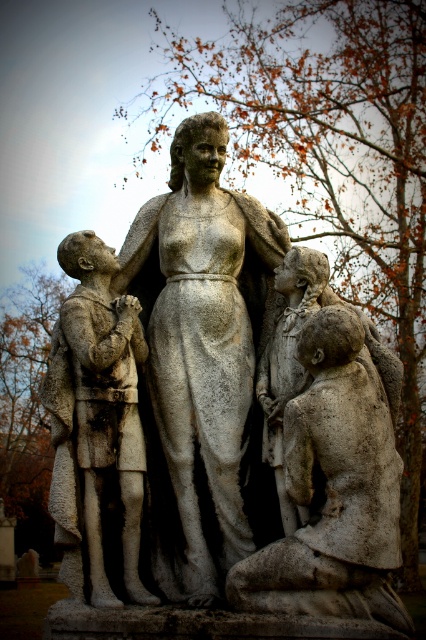
Question: Observing the image, what is the correct spatial positioning of stone statue at center in reference to stone textured girl at center?

Choices:
 (A) below
 (B) above

Answer: (B)

Question: Which of these objects is positioned farthest from the stone textured child at lower right?

Choices:
 (A) white stone statue at center
 (B) stone textured girl at center

Answer: (A)

Question: Which of these objects is positioned farthest from the stone statue at center?

Choices:
 (A) white stone statue at center
 (B) stone textured girl at center
 (C) stone statue of boy at left

Answer: (C)

Question: Can you confirm if white stone statue at center is thinner than stone textured child at lower right?

Choices:
 (A) yes
 (B) no

Answer: (B)

Question: Which of these objects is positioned closest to the stone statue of boy at left?

Choices:
 (A) white stone statue at center
 (B) stone textured child at lower right
 (C) stone statue at center

Answer: (C)

Question: Is white stone statue at center positioned at the back of stone textured girl at center?

Choices:
 (A) yes
 (B) no

Answer: (B)